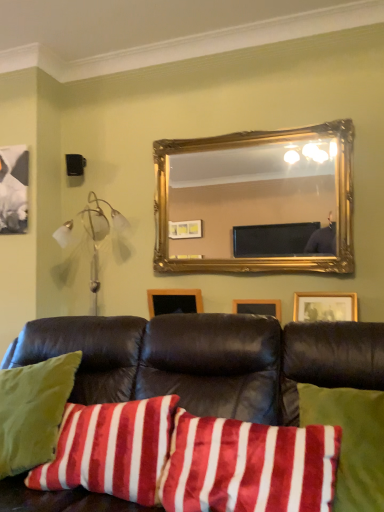
What is the approximate height of velvet black couch at center?

velvet black couch at center is 97.28 centimeters tall.

What do you see at coordinates (208, 360) in the screenshot? This screenshot has height=512, width=384. I see `velvet black couch at center` at bounding box center [208, 360].

In order to face gold ornate mirror at upper center, should I rotate leftwards or rightwards?

A 7.206 degree turn to the right will do.

What are the coordinates of `white glass lamp at left` in the screenshot? It's located at (100, 233).

What do you see at coordinates (174, 301) in the screenshot?
I see `wooden picture frame at center` at bounding box center [174, 301].

Where is `velvet black couch at center`? velvet black couch at center is located at coordinates (208, 360).

Is velvety red pillow at center, which appears as the 2th pillow when viewed from the left, in contact with white glass lamp at left?

No, velvety red pillow at center, which appears as the 2th pillow when viewed from the left, is not making contact with white glass lamp at left.

Between velvety red pillow at center, the first pillow positioned from the right, and white glass lamp at left, which one is positioned behind?

Positioned behind is white glass lamp at left.

What's the angular difference between velvety red pillow at center, the first pillow positioned from the right, and white glass lamp at left's facing directions?

There is a 3.35-degree angle between the facing directions of velvety red pillow at center, the first pillow positioned from the right, and white glass lamp at left.

Based on the photo, considering the relative positions of gold ornate mirror at upper center and velvet black couch at center in the image provided, is gold ornate mirror at upper center to the left of velvet black couch at center from the viewer's perspective?

No.

Can you confirm if gold ornate mirror at upper center is taller than velvet black couch at center?

Incorrect, the height of gold ornate mirror at upper center is not larger of that of velvet black couch at center.

Does point (229, 172) appear closer or farther from the camera than point (190, 386)?

Point (229, 172) appears to be farther away from the viewer than point (190, 386).

Considering the points (171, 305) and (195, 484), which point is in front, point (171, 305) or point (195, 484)?

The point (195, 484) is closer to the camera.

Is wooden picture frame at center to the right of velvety red pillow at center, which appears as the 2th pillow when viewed from the left, from the viewer's perspective?

In fact, wooden picture frame at center is to the left of velvety red pillow at center, which appears as the 2th pillow when viewed from the left.

Is wooden picture frame at center next to velvety red pillow at center, the first pillow positioned from the right, and touching it?

No, wooden picture frame at center is not in contact with velvety red pillow at center, the first pillow positioned from the right.

From the picture: Could you tell me if wooden picture frame at center is turned towards velvety red pillow at center, the first pillow positioned from the right?

No, wooden picture frame at center is not facing towards velvety red pillow at center, the first pillow positioned from the right.

At what (x,y) coordinates should I click in order to perform the action: click on pillow above the velvety red and white striped pillow at lower left, arranged as the second pillow when viewed from the right (from the image's perspective). Please return your answer as a coordinate pair (x, y). This screenshot has width=384, height=512. Looking at the image, I should click on (249, 466).

Would you say velvety red pillow at center, which appears as the 2th pillow when viewed from the left, is to the left or to the right of velvety red and white striped pillow at lower left, arranged as the second pillow when viewed from the right, in the picture?

Based on their positions, velvety red pillow at center, which appears as the 2th pillow when viewed from the left, is located to the right of velvety red and white striped pillow at lower left, arranged as the second pillow when viewed from the right.

Is velvety red pillow at center, which appears as the 2th pillow when viewed from the left, completely or partially outside of velvety red and white striped pillow at lower left, arranged as the second pillow when viewed from the right?

Yes, velvety red pillow at center, which appears as the 2th pillow when viewed from the left, is outside of velvety red and white striped pillow at lower left, arranged as the second pillow when viewed from the right.

Is velvety red pillow at center, the first pillow positioned from the right, taller or shorter than velvety red and white striped pillow at lower left, which is the 1th pillow in left-to-right order?

Clearly, velvety red pillow at center, the first pillow positioned from the right, is taller compared to velvety red and white striped pillow at lower left, which is the 1th pillow in left-to-right order.

From a real-world perspective, is velvet black couch at center located beneath velvety red and white striped pillow at lower left, arranged as the second pillow when viewed from the right?

Yes, from a real-world perspective, velvet black couch at center is under velvety red and white striped pillow at lower left, arranged as the second pillow when viewed from the right.

Are velvet black couch at center and velvety red and white striped pillow at lower left, arranged as the second pillow when viewed from the right, located far from each other?

velvet black couch at center is near velvety red and white striped pillow at lower left, arranged as the second pillow when viewed from the right, not far away.

How different are the orientations of velvet black couch at center and velvety red and white striped pillow at lower left, which is the 1th pillow in left-to-right order, in degrees?

The angle between the facing direction of velvet black couch at center and the facing direction of velvety red and white striped pillow at lower left, which is the 1th pillow in left-to-right order, is 0.00145 degrees.

Considering the sizes of objects velvet black couch at center and velvety red and white striped pillow at lower left, which is the 1th pillow in left-to-right order, in the image provided, who is bigger, velvet black couch at center or velvety red and white striped pillow at lower left, which is the 1th pillow in left-to-right order,?

velvet black couch at center.

Considering the positions of objects velvety red pillow at center, the first pillow positioned from the right, and wooden picture frame at center in the image provided, who is more to the left, velvety red pillow at center, the first pillow positioned from the right, or wooden picture frame at center?

Positioned to the left is wooden picture frame at center.

Locate an element on the screen. picture frame located behind the velvety red pillow at center, the first pillow positioned from the right is located at coordinates click(174, 301).

Is velvety red pillow at center, which appears as the 2th pillow when viewed from the left, oriented towards wooden picture frame at center?

No, velvety red pillow at center, which appears as the 2th pillow when viewed from the left, is not oriented towards wooden picture frame at center.

Which is correct: velvety red pillow at center, which appears as the 2th pillow when viewed from the left, is inside wooden picture frame at center, or outside of it?

velvety red pillow at center, which appears as the 2th pillow when viewed from the left, is not inside wooden picture frame at center, it's outside.

In the scene shown: Who is bigger, velvet black couch at center or velvety red pillow at center, which appears as the 2th pillow when viewed from the left?

Bigger between the two is velvet black couch at center.

Considering the relative positions of velvet black couch at center and velvety red pillow at center, which appears as the 2th pillow when viewed from the left, in the image provided, is velvet black couch at center in front of velvety red pillow at center, which appears as the 2th pillow when viewed from the left,?

Yes, it is.

Is velvet black couch at center not within velvety red pillow at center, the first pillow positioned from the right?

Indeed, velvet black couch at center is completely outside velvety red pillow at center, the first pillow positioned from the right.

Where is `the 1st pillow behind when counting from the velvet black couch at center`? The image size is (384, 512). the 1st pillow behind when counting from the velvet black couch at center is located at coordinates (249, 466).

The height and width of the screenshot is (512, 384). What are the coordinates of `the 1st pillow below when counting from the white glass lamp at left (from the image's perspective)` in the screenshot? It's located at (249, 466).

In the image, there is a gold ornate mirror at upper center. Identify the location of studio couch below it (from a real-world perspective). (208, 360).

Based on their spatial positions, is velvety red pillow at center, which appears as the 2th pillow when viewed from the left, or wooden picture frame at center closer to gold ornate mirror at upper center?

Based on the image, wooden picture frame at center appears to be nearer to gold ornate mirror at upper center.

Consider the image. Based on their spatial positions, is wooden picture frame at center or white glass lamp at left further from velvety red and white striped pillow at lower left, which is the 1th pillow in left-to-right order?

A: Based on the image, white glass lamp at left appears to be further to velvety red and white striped pillow at lower left, which is the 1th pillow in left-to-right order.

Estimate the real-world distances between objects in this image. Which object is closer to velvety red and white striped pillow at lower left, arranged as the second pillow when viewed from the right, velvet black couch at center or gold ornate mirror at upper center?

Based on the image, velvet black couch at center appears to be nearer to velvety red and white striped pillow at lower left, arranged as the second pillow when viewed from the right.

Based on their spatial positions, is wooden picture frame at center or white glass lamp at left further from velvet black couch at center?

white glass lamp at left is positioned further to the anchor velvet black couch at center.

Based on their spatial positions, is velvety red pillow at center, the first pillow positioned from the right, or velvety red and white striped pillow at lower left, arranged as the second pillow when viewed from the right, further from white glass lamp at left?

velvety red pillow at center, the first pillow positioned from the right, is positioned further to the anchor white glass lamp at left.

Estimate the real-world distances between objects in this image. Which object is further from velvety red pillow at center, which appears as the 2th pillow when viewed from the left, gold ornate mirror at upper center or velvety red and white striped pillow at lower left, which is the 1th pillow in left-to-right order?

Based on the image, gold ornate mirror at upper center appears to be further to velvety red pillow at center, which appears as the 2th pillow when viewed from the left.

When comparing their distances from velvet black couch at center, does velvety red pillow at center, the first pillow positioned from the right, or wooden picture frame at center seem closer?

The object closer to velvet black couch at center is velvety red pillow at center, the first pillow positioned from the right.

Looking at the image, which one is located further to velvet black couch at center, velvety red and white striped pillow at lower left, arranged as the second pillow when viewed from the right, or white glass lamp at left?

white glass lamp at left.

Where is `lamp between velvety red pillow at center, which appears as the 2th pillow when viewed from the left, and gold ornate mirror at upper center, along the z-axis`? lamp between velvety red pillow at center, which appears as the 2th pillow when viewed from the left, and gold ornate mirror at upper center, along the z-axis is located at coordinates (100, 233).

I want to click on pillow between velvety red pillow at center, the first pillow positioned from the right, and white glass lamp at left in the front-back direction, so click(111, 449).

Find the location of a particular element. The height and width of the screenshot is (512, 384). mirror positioned between velvety red and white striped pillow at lower left, which is the 1th pillow in left-to-right order, and wooden picture frame at center from near to far is located at coordinates (247, 192).

Find the location of a particular element. pillow between velvet black couch at center and velvety red and white striped pillow at lower left, which is the 1th pillow in left-to-right order, from front to back is located at coordinates (249, 466).